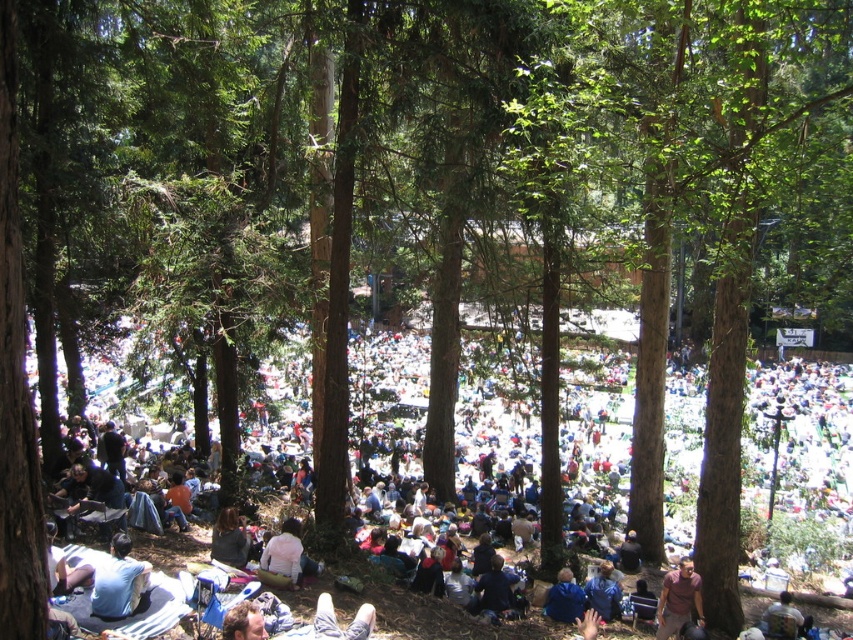
Question: Which object is the farthest from the light brown leather jacket at lower right?

Choices:
 (A) blue fabric jacket at lower center
 (B) dark gray sweater at lower center
 (C) blue denim jeans at lower center
 (D) pink fabric at lower center

Answer: (B)

Question: Can you confirm if light blue fabric at lower left is positioned to the left of blue fabric jacket at lower center?

Choices:
 (A) no
 (B) yes

Answer: (A)

Question: Does light brown leather jacket at lower right have a greater width compared to blue fabric jacket at lower center?

Choices:
 (A) yes
 (B) no

Answer: (A)

Question: Which of the following is the closest to the observer?

Choices:
 (A) (274, 541)
 (B) (519, 420)
 (C) (701, 605)

Answer: (A)

Question: Which point is closer to the camera?

Choices:
 (A) (289, 561)
 (B) (672, 609)
 (C) (573, 612)

Answer: (A)

Question: In this image, where is pink fabric at lower center located relative to blue fabric jacket at lower center?

Choices:
 (A) right
 (B) left

Answer: (B)